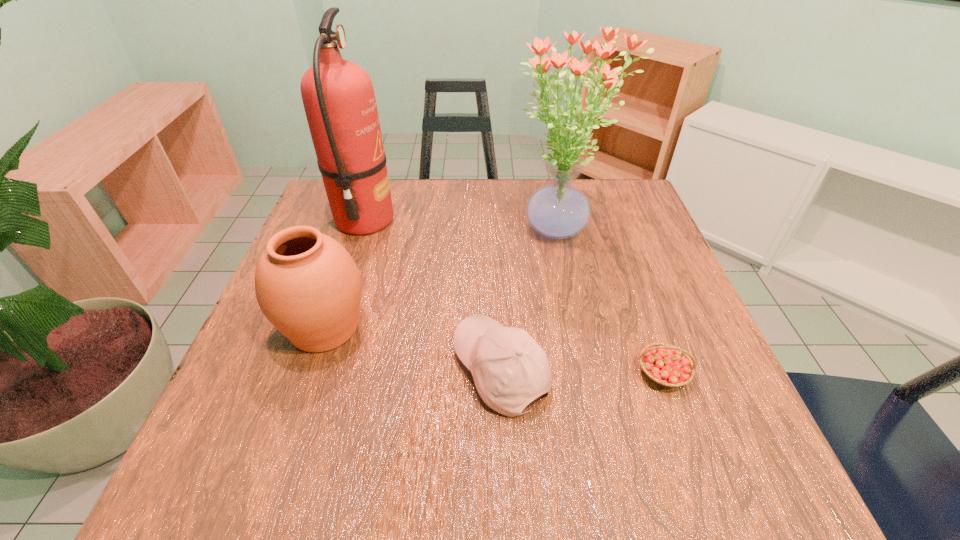
Find the location of a particular element. This screenshot has height=540, width=960. vacant space located 0.380m on the front-facing side of the fourth tallest object is located at coordinates (238, 370).

Image resolution: width=960 pixels, height=540 pixels. Identify the location of vacant space located on the back of the shortest object. (632, 287).

Find the location of a particular element. The height and width of the screenshot is (540, 960). fire extinguisher situated at the far edge is located at coordinates (339, 101).

Identify the location of flower arrangement that is at the far edge. The width and height of the screenshot is (960, 540). point(558,210).

Locate an element on the screen. This screenshot has height=540, width=960. fire extinguisher at the left edge is located at coordinates (339, 101).

Where is `urn present at the left edge`? The width and height of the screenshot is (960, 540). urn present at the left edge is located at coordinates (307, 285).

The width and height of the screenshot is (960, 540). Identify the location of flower arrangement situated at the right edge. (x=558, y=210).

You are a GUI agent. You are given a task and a screenshot of the screen. Output one action in this format:
    pyautogui.click(x=<x>, y=<y>)
    Task: Click on the strawberry located at the right edge
    This screenshot has width=960, height=540.
    Given the screenshot: What is the action you would take?
    pyautogui.click(x=666, y=365)

I want to click on object located in the far left corner section of the desktop, so click(339, 101).

You are a GUI agent. You are given a task and a screenshot of the screen. Output one action in this format:
    pyautogui.click(x=<x>, y=<y>)
    Task: Click on the object at the far right corner
    
    Given the screenshot: What is the action you would take?
    pyautogui.click(x=558, y=210)